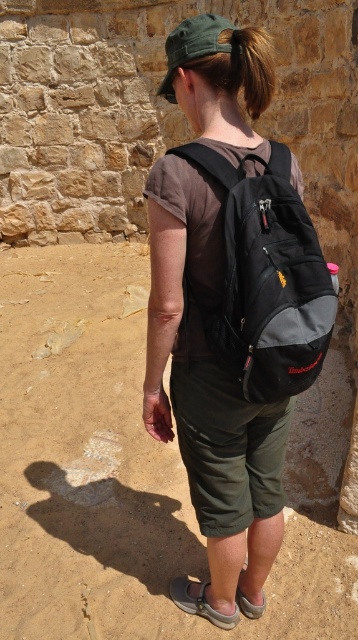
Question: Which object is positioned closest to the black fabric backpack at back?

Choices:
 (A) gray fabric sandal at lower center
 (B) matte black backpack at center
 (C) brown hair at upper center

Answer: (B)

Question: Estimate the real-world distances between objects in this image. Which object is closer to the black fabric backpack at back?

Choices:
 (A) gray fabric sandal at lower center
 (B) brown hair at upper center
 (C) matte black backpack at center

Answer: (C)

Question: Does black fabric backpack at back lie in front of brown hair at upper center?

Choices:
 (A) no
 (B) yes

Answer: (B)

Question: Which object is the farthest from the black fabric backpack at back?

Choices:
 (A) brown hair at upper center
 (B) gray fabric sandal at lower center
 (C) matte black backpack at center

Answer: (B)

Question: Does matte black backpack at center come behind black fabric backpack at back?

Choices:
 (A) no
 (B) yes

Answer: (B)

Question: Does black fabric backpack at back appear on the left side of brown hair at upper center?

Choices:
 (A) no
 (B) yes

Answer: (A)